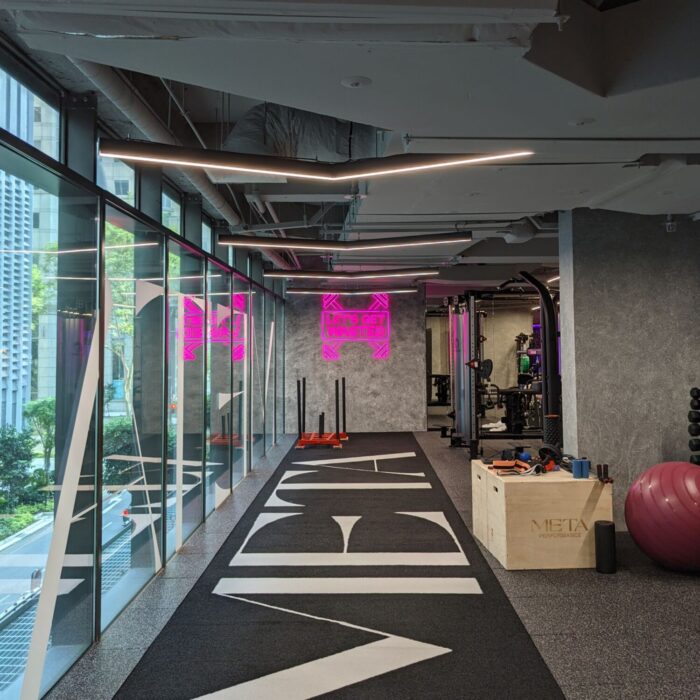
This screenshot has height=700, width=700. In order to click on large exercise machines, black in this screenshot , I will do `click(535, 395)`, `click(460, 390)`, `click(444, 383)`.